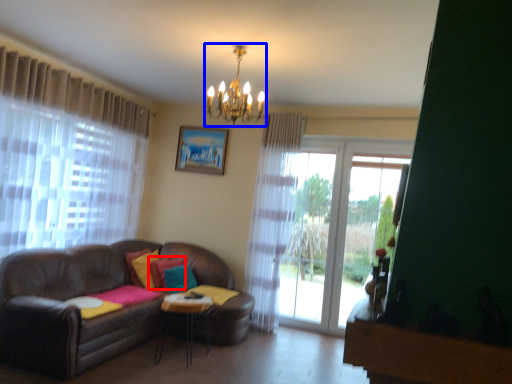
Question: Which point is closer to the camera, pillow (highlighted by a red box) or light fixture (highlighted by a blue box)?

Choices:
 (A) pillow
 (B) light fixture

Answer: (B)